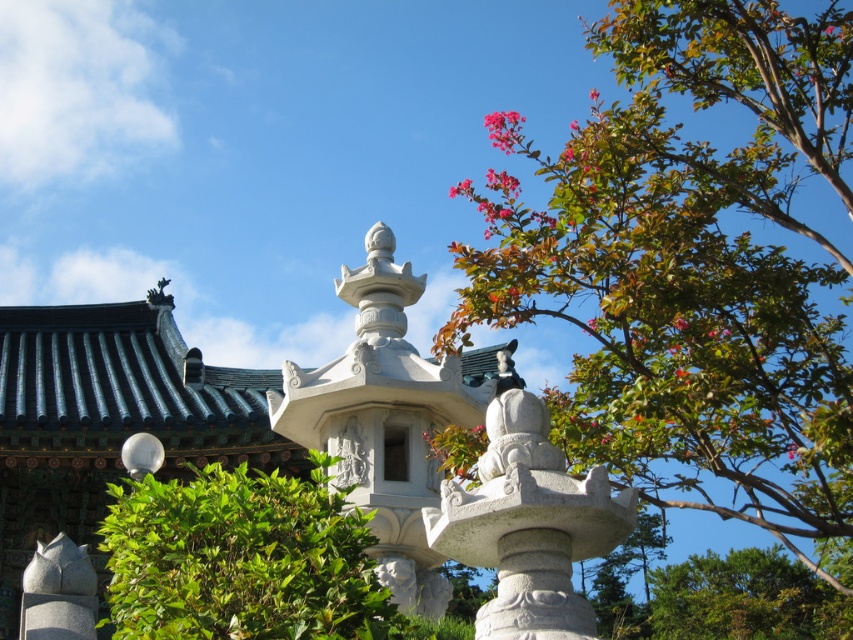
Which is below, green leafy bush at lower right or white stone carving at center?

green leafy bush at lower right is below.

Image resolution: width=853 pixels, height=640 pixels. I want to click on green leafy bush at lower right, so click(x=746, y=598).

The height and width of the screenshot is (640, 853). I want to click on green leafy bush at lower right, so click(x=746, y=598).

Who is positioned more to the right, green leafy bush at lower right or pink matte flower at upper right?

green leafy bush at lower right

Identify the location of green leafy bush at lower right. (746, 598).

Locate an element on the screen. green leafy bush at lower right is located at coordinates (746, 598).

Is the position of green leafy bush at lower right less distant than that of white stone statue at center?

No, it is behind white stone statue at center.

Between green leafy bush at lower right and white stone statue at center, which one has less height?

Standing shorter between the two is white stone statue at center.

Which is behind, point (706, 632) or point (518, 380)?

Point (706, 632)

Locate an element on the screen. green leafy bush at lower right is located at coordinates (746, 598).